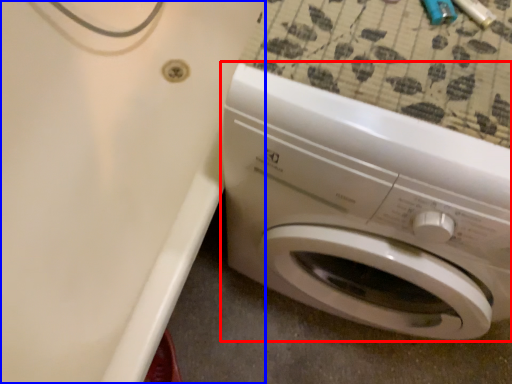
Question: Which point is closer to the camera, washing machine (highlighted by a red box) or bath (highlighted by a blue box)?

Choices:
 (A) washing machine
 (B) bath

Answer: (A)